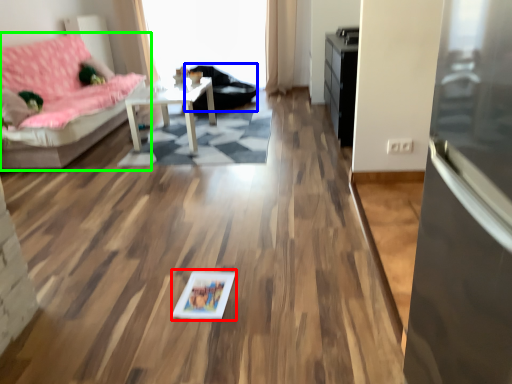
Question: Which is farther away from picture frame (highlighted by a red box)? armchair (highlighted by a blue box) or studio couch (highlighted by a green box)?

Choices:
 (A) armchair
 (B) studio couch

Answer: (A)